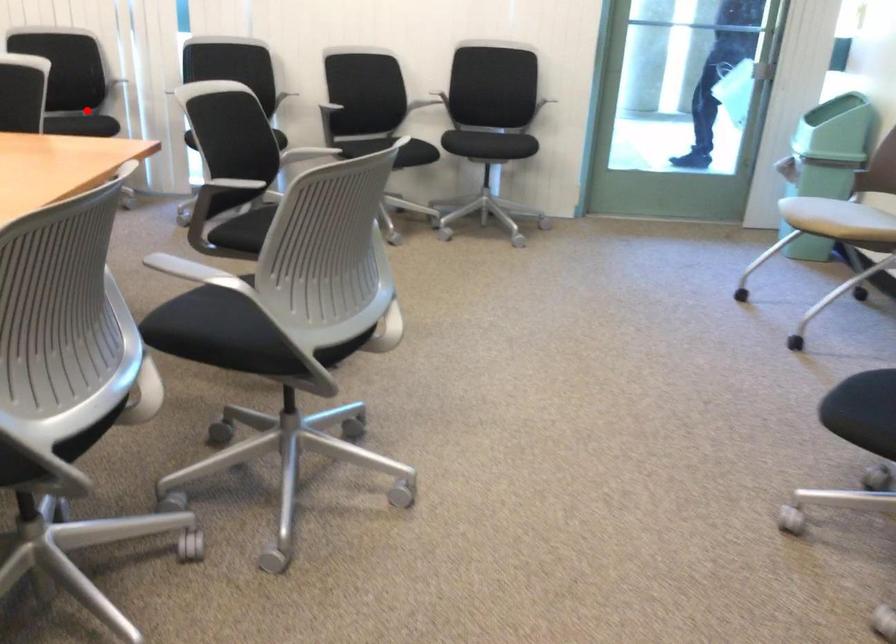
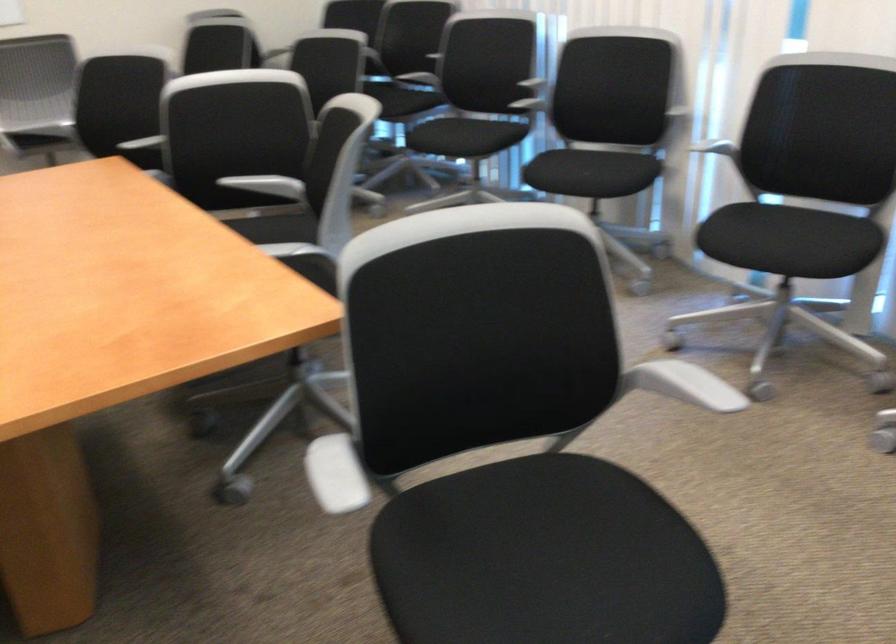
Question: A red point is marked in image1. In image2, is the corresponding 3D point closer to the camera or farther? Reply with the corresponding letter.

Choices:
 (A) The corresponding 3D point is closer.
 (B) The corresponding 3D point is farther.

Answer: (A)